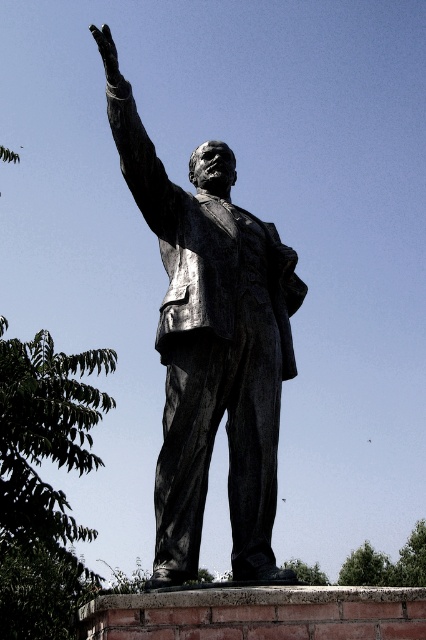
You are standing in front of the statue and want to determine the relative positions of two points on it. The first point is at coordinate point (193, 184) and the second is at point (118, 84). Which point is closer to you?

Point (118, 84) is closer to you because it is less further to the camera than point (193, 184).

Based on the photo, you are an art student analyzing the statue. You notice the bronze statue at center and the bronze statue arm at upper left. Which object is positioned more to the left side of the image?

The bronze statue arm at upper left is positioned more to the left side of the image compared to the bronze statue at center.